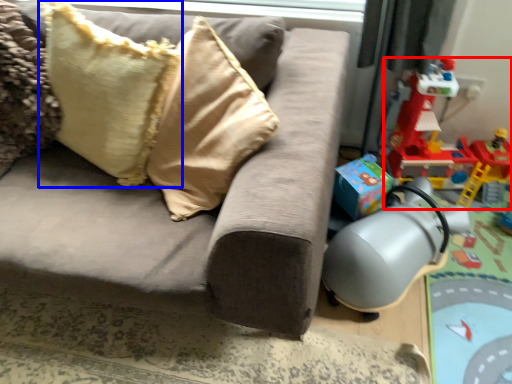
Question: Which object is closer to the camera taking this photo, toy (highlighted by a red box) or pillow (highlighted by a blue box)?

Choices:
 (A) toy
 (B) pillow

Answer: (B)